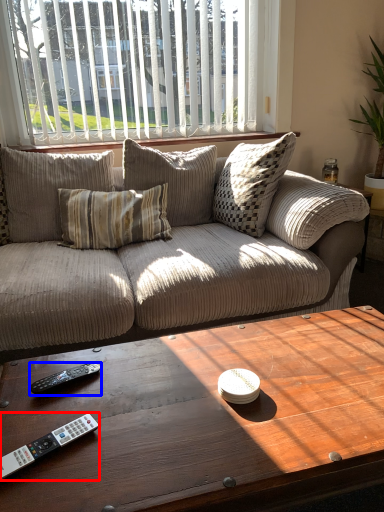
Question: Among these objects, which one is nearest to the camera, remote control (highlighted by a red box) or remote control (highlighted by a blue box)?

Choices:
 (A) remote control
 (B) remote control

Answer: (A)